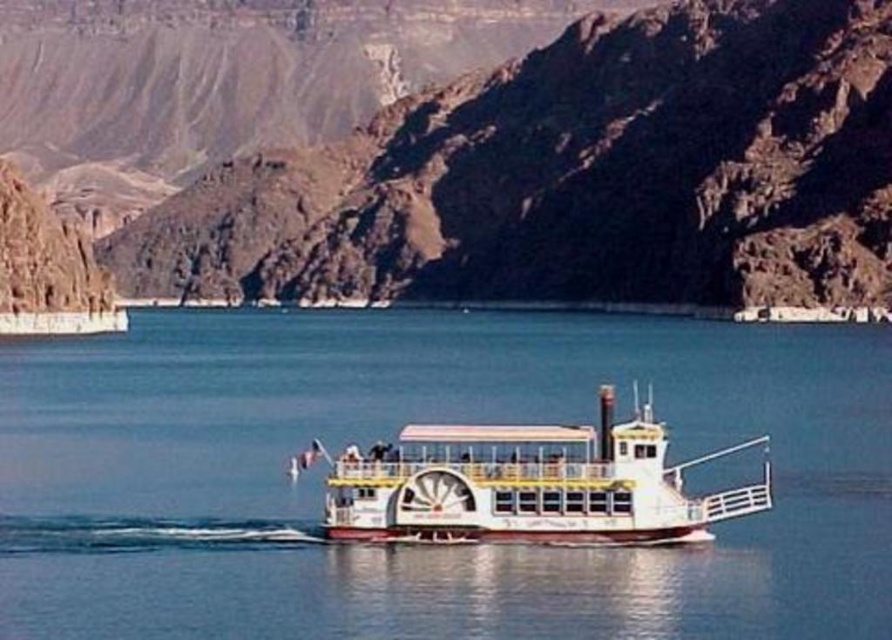
Question: Which point is farther to the camera?

Choices:
 (A) (775, 147)
 (B) (17, 628)

Answer: (A)

Question: Is brown rocky mountain at center closer to the viewer compared to white glossy water at center?

Choices:
 (A) no
 (B) yes

Answer: (A)

Question: Is white glossy water at center wider than white polished wood cruise ship at center?

Choices:
 (A) no
 (B) yes

Answer: (B)

Question: Which of the following is the closest to the observer?

Choices:
 (A) white polished wood cruise ship at center
 (B) white glossy water at center
 (C) brown rocky mountain at center

Answer: (B)

Question: Which of the following is the closest to the observer?

Choices:
 (A) (332, 508)
 (B) (729, 170)
 (C) (766, 557)

Answer: (C)

Question: Is white glossy water at center above white polished wood cruise ship at center?

Choices:
 (A) yes
 (B) no

Answer: (A)